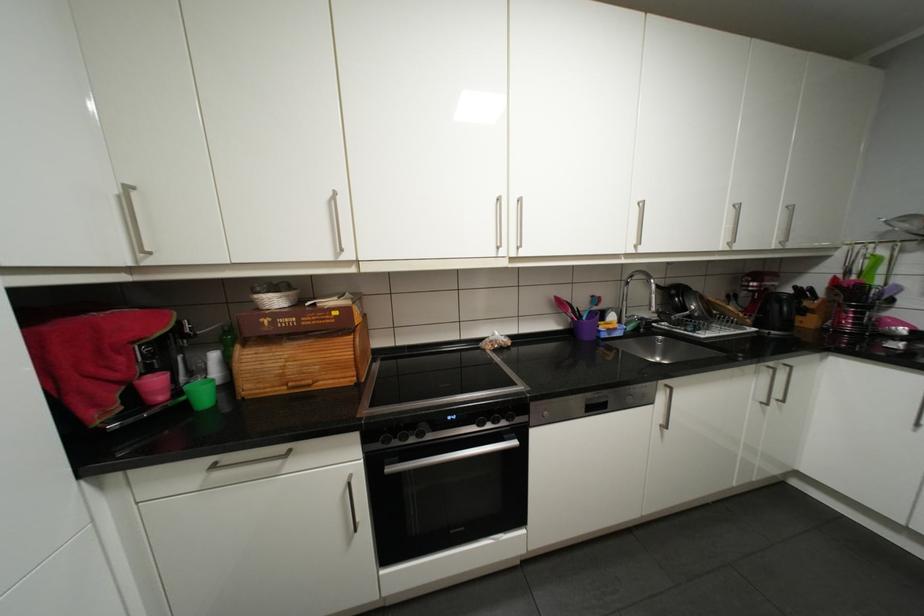
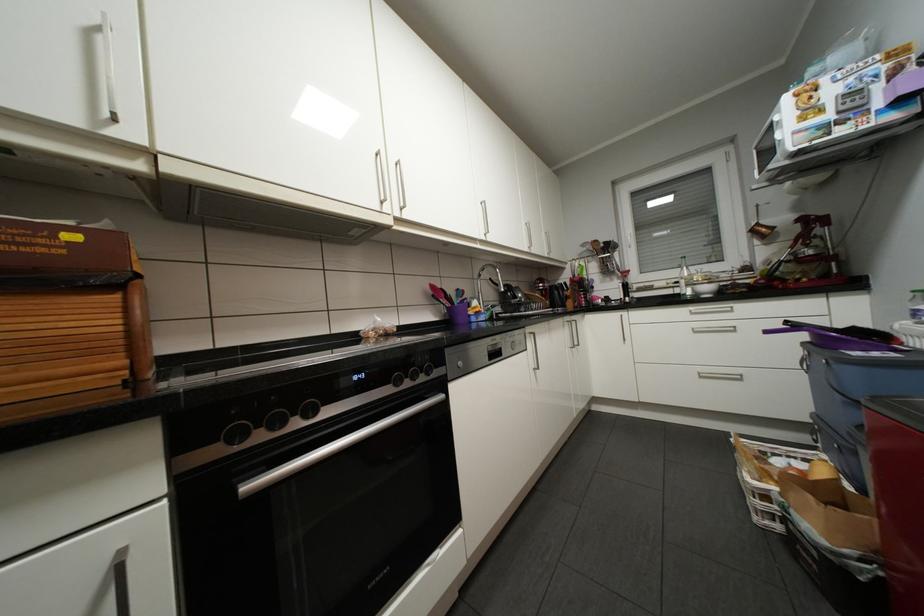
In the second image, find the point that corresponds to point (396, 469) in the first image.

(254, 485)